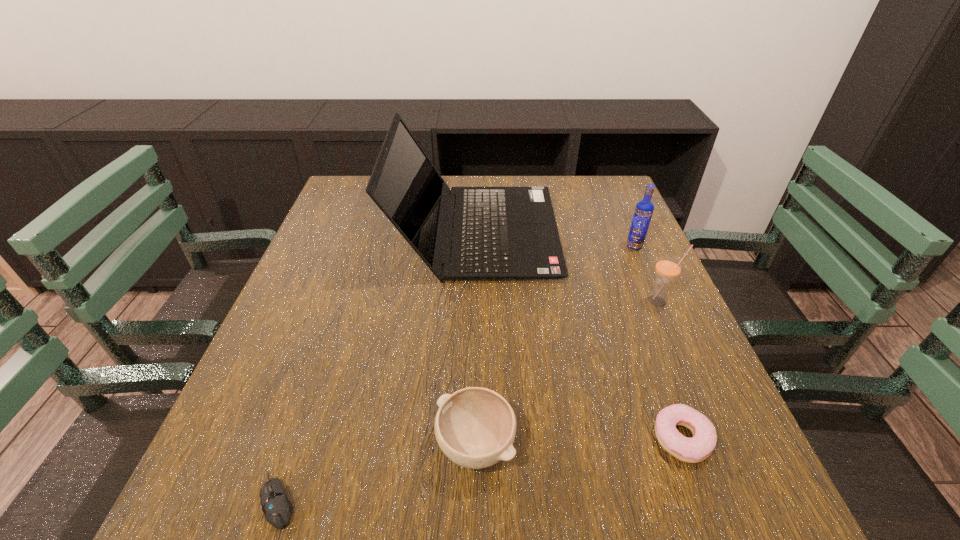
The height and width of the screenshot is (540, 960). In order to click on the tallest object in this screenshot , I will do `click(499, 232)`.

Where is `vodka`? vodka is located at coordinates (644, 209).

This screenshot has width=960, height=540. In order to click on straw in this screenshot , I will do `click(668, 267)`.

In order to click on the fourth tallest object in this screenshot , I will do `click(475, 427)`.

I want to click on doughnut, so click(x=698, y=448).

You are a GUI agent. You are given a task and a screenshot of the screen. Output one action in this format:
    pyautogui.click(x=<x>, y=<y>)
    Task: Click on the computer mouse
    
    Given the screenshot: What is the action you would take?
    pyautogui.click(x=277, y=508)

Locate an element on the screen. The image size is (960, 540). the leftmost object is located at coordinates (277, 508).

Identify the location of vacant space located 0.050m on the screen of the laptop computer. The image size is (960, 540). (575, 232).

Locate an element on the screen. The width and height of the screenshot is (960, 540). vacant space situated 0.280m on the back of the vodka is located at coordinates (608, 186).

This screenshot has width=960, height=540. I want to click on vacant point located 0.300m on the back of the fourth nearest object, so click(x=622, y=218).